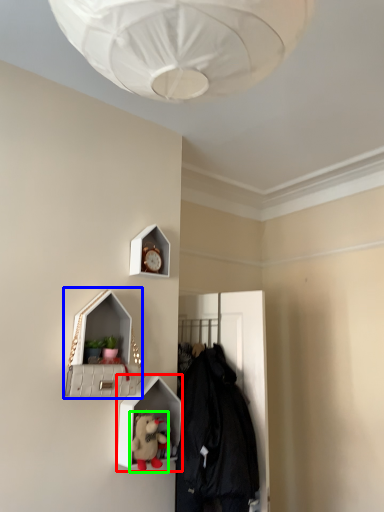
Question: Which is farther away from shelf (highlighted by a red box)? medicine cabinet (highlighted by a blue box) or toy (highlighted by a green box)?

Choices:
 (A) medicine cabinet
 (B) toy

Answer: (A)